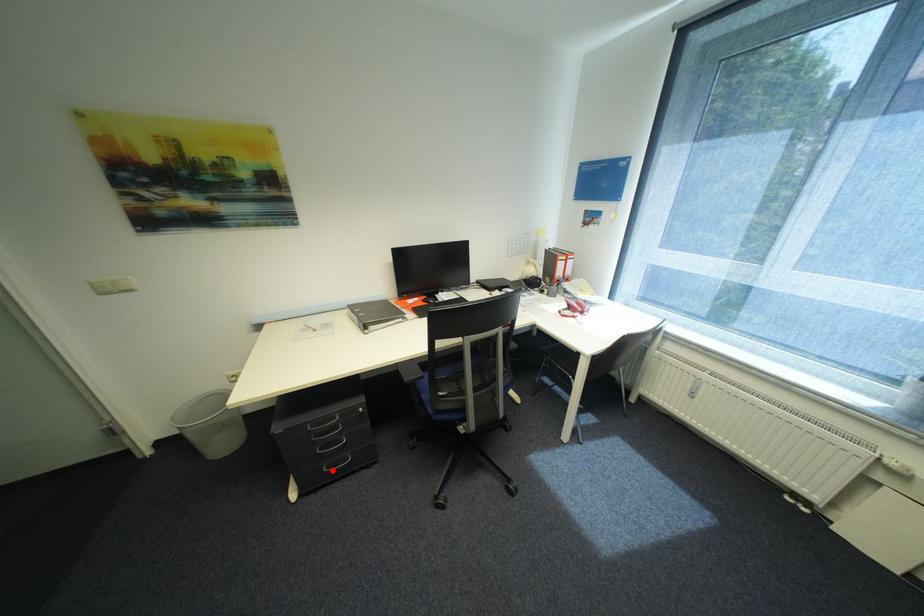
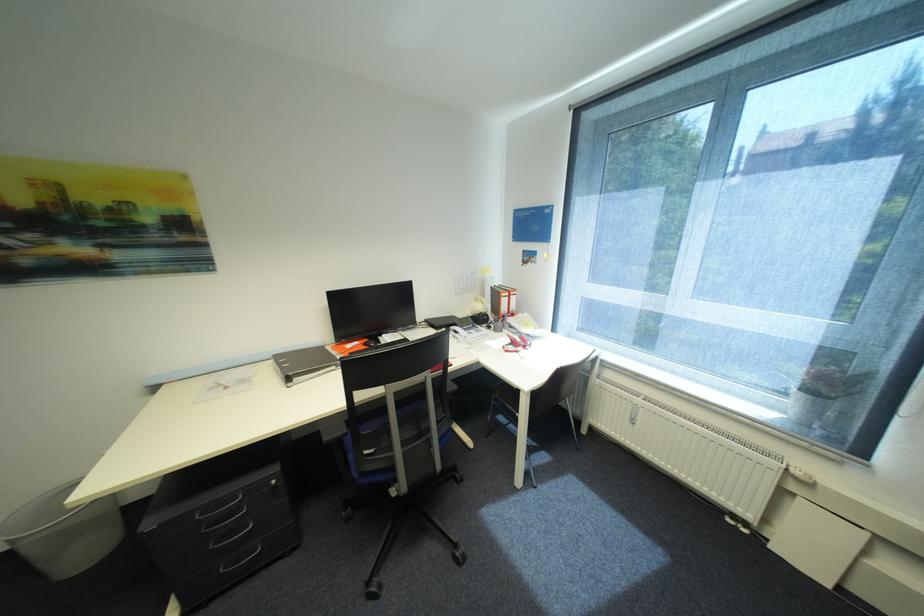
Question: I am providing you with two images of the same scene from different viewpoints. In image1, a red point is highlighted. Considering the same 3D point in image2, which of the following is correct?

Choices:
 (A) It is closer
 (B) It is farther

Answer: (A)